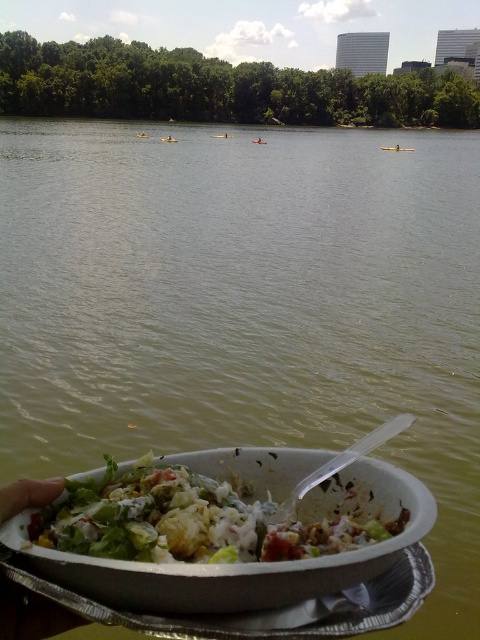
You are planning to place the fresh green salad at lower center and the yellow plastic kayak at center on a table. Which object requires a larger space on the table?

The yellow plastic kayak at center requires a larger space on the table because the fresh green salad at lower center has a smaller width compared to the yellow plastic kayak at center.

You are a photographer trying to capture the fresh green salad at lower center and the metallic gold kayak at center in a single shot. Based on their positions, which object should you focus on first to ensure both are in frame?

The fresh green salad at lower center is located below the metallic gold kayak at center, so you should focus on the metallic gold kayak at center first to ensure both are in frame.